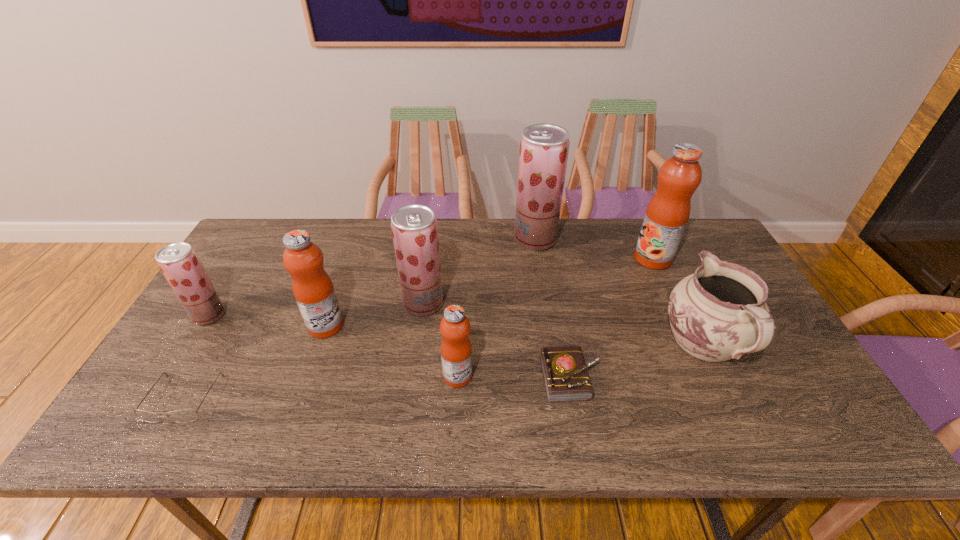
Identify the location of object located at the right edge. [718, 313].

Where is `object positioned at the near left corner`? The image size is (960, 540). object positioned at the near left corner is located at coordinates (181, 416).

Locate an element on the screen. This screenshot has height=540, width=960. blank space at the far edge is located at coordinates (519, 245).

In the image, there is a desktop. In order to click on vacant region at the near edge in this screenshot , I will do `click(432, 438)`.

In the image, there is a desktop. Where is `free space at the right edge`? The height and width of the screenshot is (540, 960). free space at the right edge is located at coordinates (764, 360).

At what (x,y) coordinates should I click in order to perform the action: click on vacant space at the far right corner of the desktop. Please return your answer as a coordinate pair (x, y). The height and width of the screenshot is (540, 960). Looking at the image, I should click on (714, 240).

Where is `vacant space in between the biggest orange fruit juice and the diary`? vacant space in between the biggest orange fruit juice and the diary is located at coordinates (612, 318).

The image size is (960, 540). Find the location of `vacant space that is in between the leftmost orange fruit juice and the leftmost strawberry fruit juice`. vacant space that is in between the leftmost orange fruit juice and the leftmost strawberry fruit juice is located at coordinates (268, 320).

In order to click on vacant area that lies between the second smallest orange fruit juice and the purple pitcher in this screenshot , I will do `click(516, 335)`.

Identify the location of vacant space that's between the third object from left to right and the purple pitcher. (516, 335).